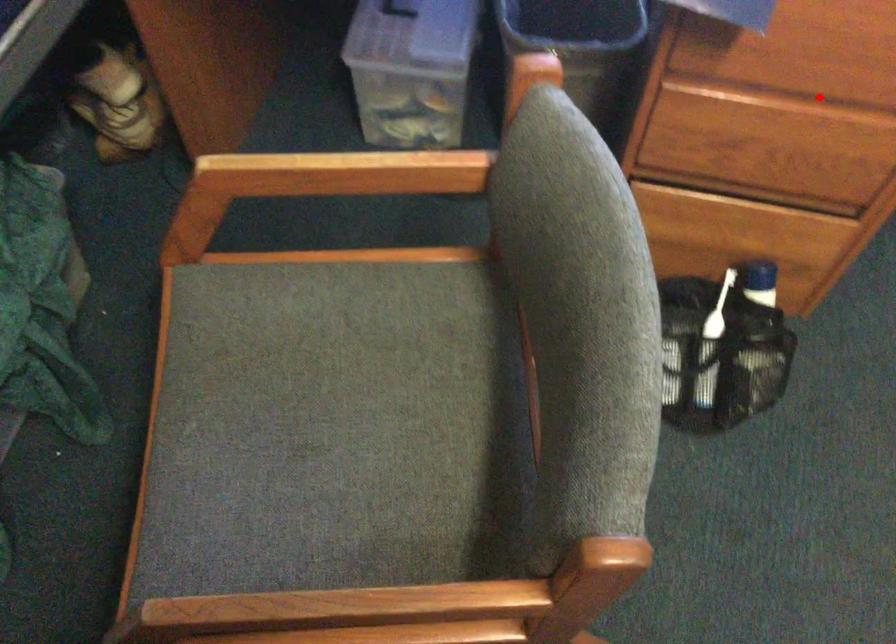
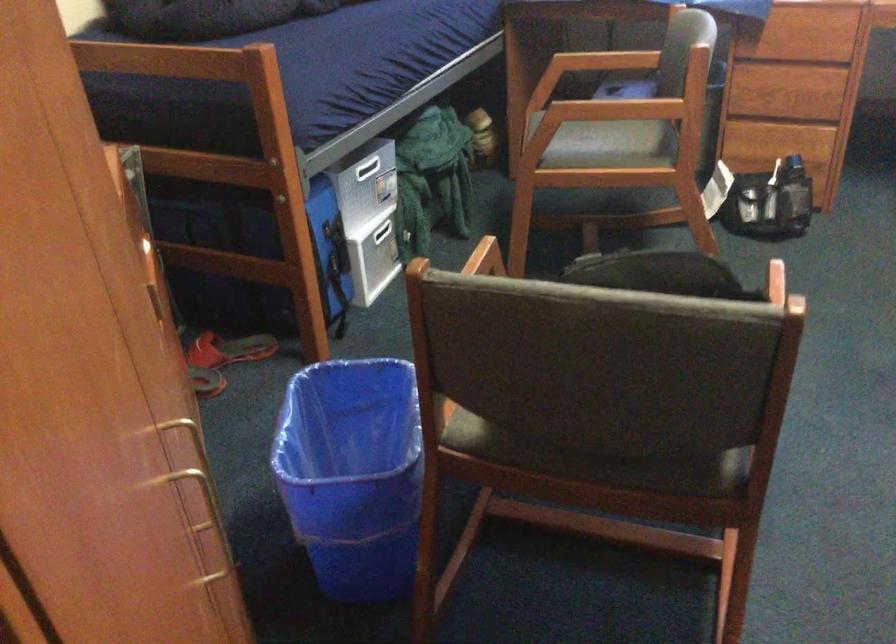
Question: I am providing you with two images of the same scene from different viewpoints. Image1 has a red point marked. In image2, the corresponding 3D location appears at what relative position? Reply with the corresponding letter.

Choices:
 (A) Closer
 (B) Farther

Answer: (B)